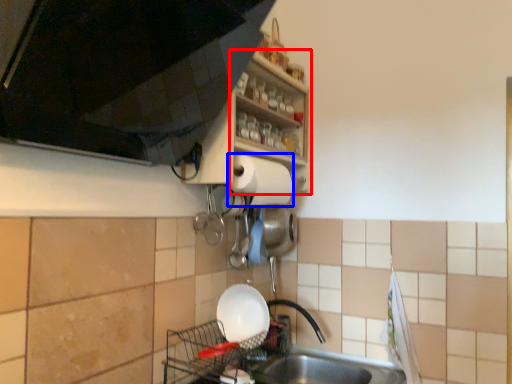
Question: Which object appears closest to the camera in this image, shelf (highlighted by a red box) or paper towel (highlighted by a blue box)?

Choices:
 (A) shelf
 (B) paper towel

Answer: (A)